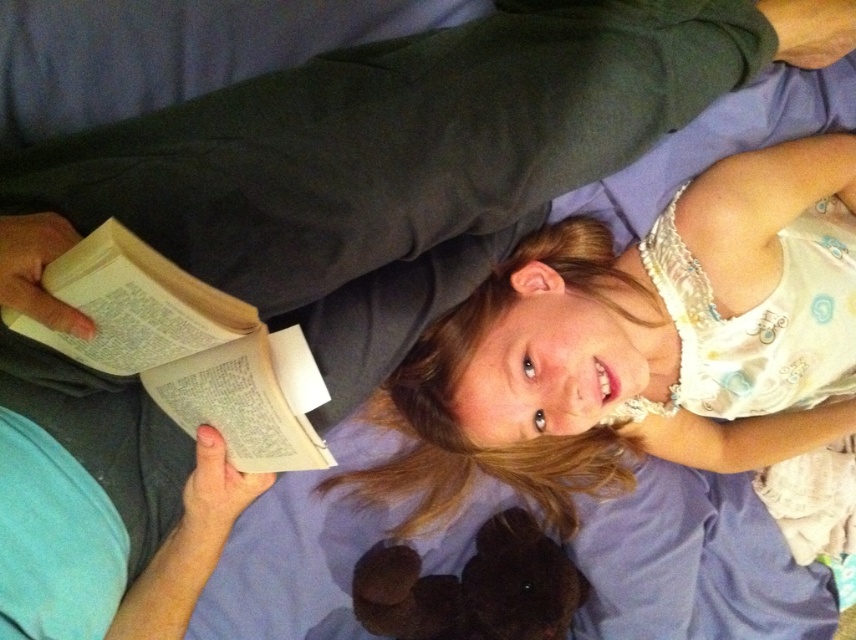
Where is `smooth white shirt at center`? The image size is (856, 640). smooth white shirt at center is located at coordinates (645, 342).

Can you confirm if smooth white shirt at center is positioned to the left of dark brown plush at lower center?

Incorrect, smooth white shirt at center is not on the left side of dark brown plush at lower center.

Does point (622, 426) come behind point (400, 624)?

Yes, point (622, 426) is behind point (400, 624).

This screenshot has height=640, width=856. I want to click on smooth white shirt at center, so click(x=645, y=342).

Is smooth white shirt at center wider than white paper book at left?

Yes.

Between smooth white shirt at center and white paper book at left, which one appears on the right side from the viewer's perspective?

smooth white shirt at center is more to the right.

Locate an element on the screen. The height and width of the screenshot is (640, 856). smooth white shirt at center is located at coordinates (645, 342).

Is white paper book at left positioned before dark brown plush at lower center?

Yes, white paper book at left is in front of dark brown plush at lower center.

Does point (120, 342) come closer to viewer compared to point (583, 586)?

Yes.

Which is in front, point (206, 333) or point (508, 636)?

Point (206, 333)

The image size is (856, 640). What are the coordinates of `white paper book at left` in the screenshot? It's located at (187, 349).